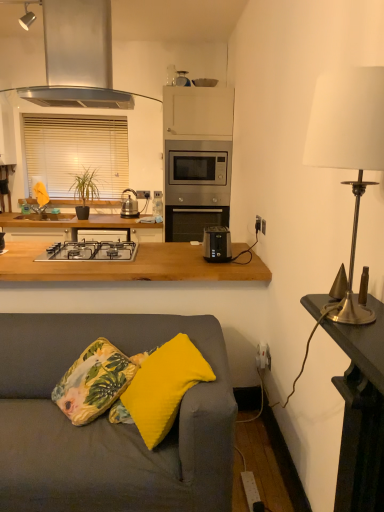
Question: From the image's perspective, relative to yellow fabric pillow at lower center, the 2th pillow viewed from the front, is green matte plant at left above or below?

Choices:
 (A) below
 (B) above

Answer: (B)

Question: Is green matte plant at left situated inside yellow fabric pillow at lower center, the 2th pillow viewed from the front, or outside?

Choices:
 (A) outside
 (B) inside

Answer: (A)

Question: Considering the real-world distances, which object is closest to the stainless steel cabinet at upper center?

Choices:
 (A) floral fabric throw pillow at lower left
 (B) gold metallic table at right
 (C) yellow fabric pillow at lower center, which is counted as the first pillow, starting from the back
 (D) satin silver range hood at upper center
 (E) yellow fabric pillow at lower left, which is the second pillow from back to front

Answer: (D)

Question: Which is farther from the green matte plant at left?

Choices:
 (A) white plastic electric outlet at right
 (B) white blinds at upper left
 (C) black plastic toaster at center
 (D) stainless steel cabinet at upper center
 (E) floral fabric throw pillow at lower left

Answer: (E)